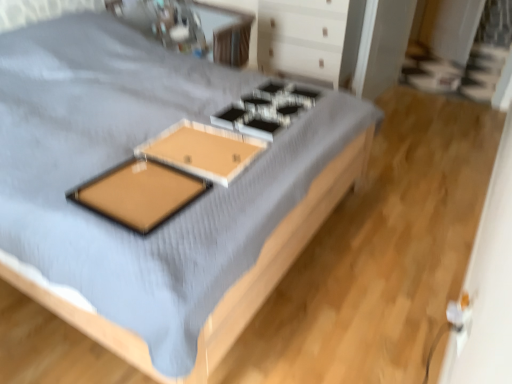
Question: Is the position of white glossy drawer at upper center more distant than that of metallic silver gas stove at center?

Choices:
 (A) yes
 (B) no

Answer: (A)

Question: Is white glossy drawer at upper center not inside metallic silver gas stove at center?

Choices:
 (A) no
 (B) yes

Answer: (B)

Question: Would you consider white glossy drawer at upper center to be distant from metallic silver gas stove at center?

Choices:
 (A) yes
 (B) no

Answer: (A)

Question: From a real-world perspective, is white glossy drawer at upper center physically below metallic silver gas stove at center?

Choices:
 (A) yes
 (B) no

Answer: (A)

Question: From a real-world perspective, is white glossy drawer at upper center positioned over metallic silver gas stove at center based on gravity?

Choices:
 (A) yes
 (B) no

Answer: (B)

Question: Is metallic silver gas stove at center to the left or to the right of wooden tray at center, arranged as the 2th table when viewed from the top, in the image?

Choices:
 (A) right
 (B) left

Answer: (A)

Question: From their relative heights in the image, would you say metallic silver gas stove at center is taller or shorter than wooden tray at center, which is the 1th table in bottom-to-top order?

Choices:
 (A) short
 (B) tall

Answer: (B)

Question: From the image's perspective, is metallic silver gas stove at center positioned above or below wooden tray at center, arranged as the 2th table when viewed from the top?

Choices:
 (A) below
 (B) above

Answer: (B)

Question: Does point (274, 94) appear closer or farther from the camera than point (186, 160)?

Choices:
 (A) closer
 (B) farther

Answer: (B)

Question: From the image's perspective, relative to metallic silver gas stove at center, is wooden bed at center above or below?

Choices:
 (A) below
 (B) above

Answer: (A)

Question: Considering their positions, is wooden bed at center located in front of or behind metallic silver gas stove at center?

Choices:
 (A) front
 (B) behind

Answer: (A)

Question: In terms of height, does wooden bed at center look taller or shorter compared to metallic silver gas stove at center?

Choices:
 (A) short
 (B) tall

Answer: (B)

Question: From a real-world perspective, relative to metallic silver gas stove at center, is wooden bed at center vertically above or below?

Choices:
 (A) below
 (B) above

Answer: (A)

Question: From a real-world perspective, is brown matte board at center positioned above or below white glossy drawer at upper center?

Choices:
 (A) above
 (B) below

Answer: (A)

Question: Which is correct: brown matte board at center is inside white glossy drawer at upper center, or outside of it?

Choices:
 (A) outside
 (B) inside

Answer: (A)